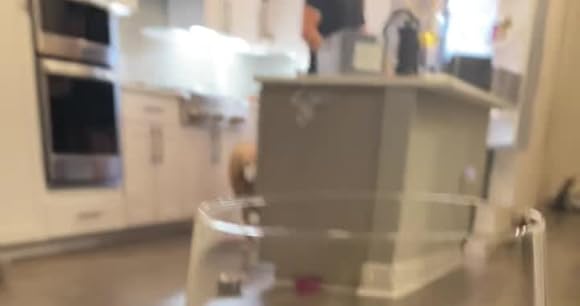
Where is `cupboard`? Image resolution: width=580 pixels, height=306 pixels. cupboard is located at coordinates (139, 150), (176, 155).